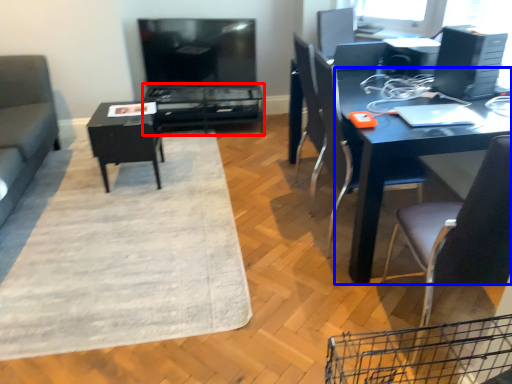
Question: Which object appears farthest to the camera in this image, table (highlighted by a red box) or desk (highlighted by a blue box)?

Choices:
 (A) table
 (B) desk

Answer: (A)